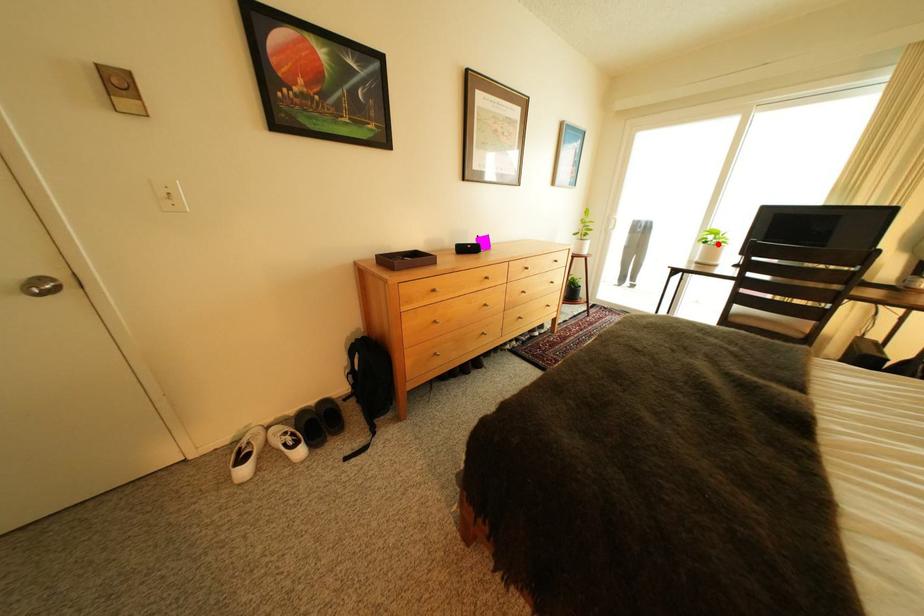
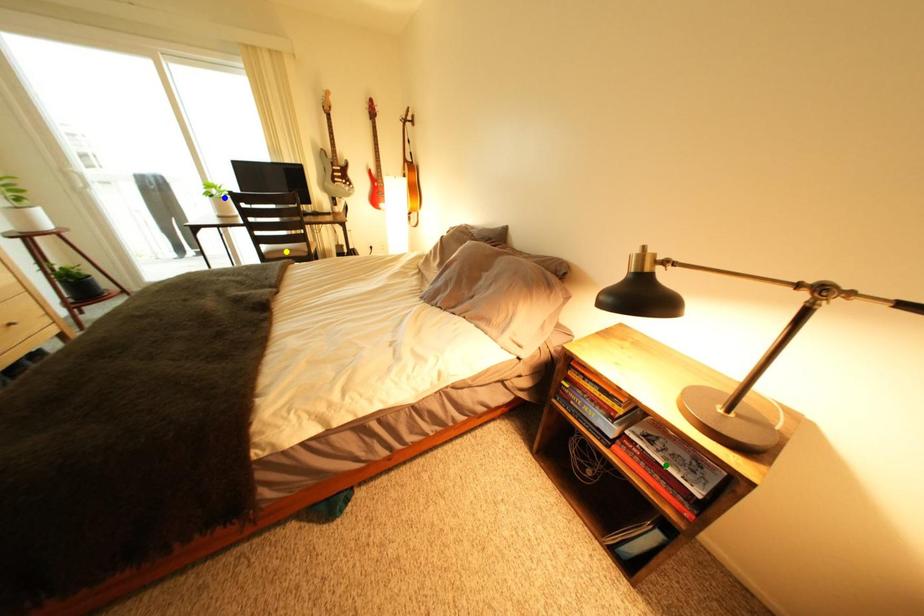
Question: I am providing you with two images of the same scene from different viewpoints. A red point is marked on the first image. You are given multiple points on the second image. Can you choose the point in image 2 that corresponds to the point in image 1?

Choices:
 (A) green point
 (B) blue point
 (C) yellow point

Answer: (B)